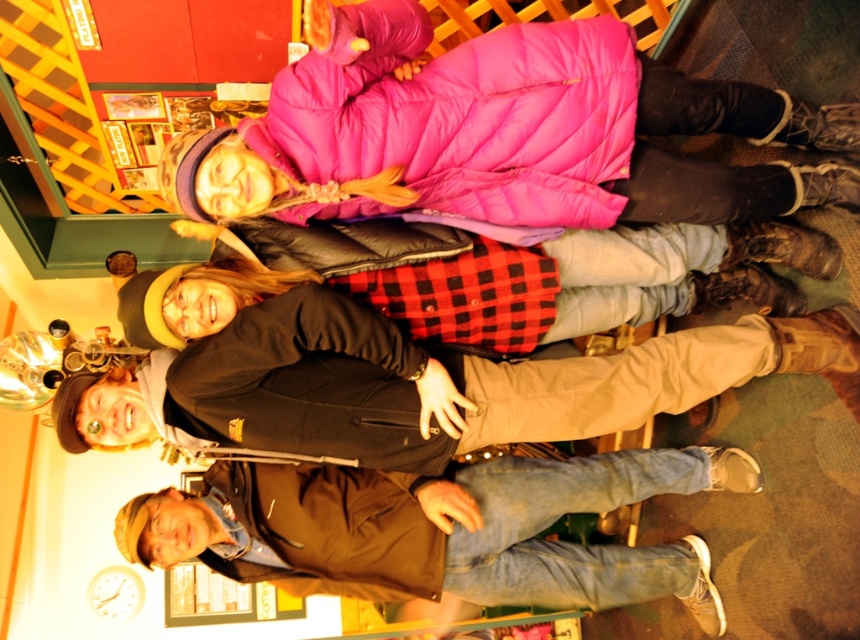
Does pink puffy coat at upper center appear on the right side of black cotton jacket at center?

Yes, pink puffy coat at upper center is to the right of black cotton jacket at center.

Can you confirm if pink puffy coat at upper center is shorter than black cotton jacket at center?

No.

Between point (235, 145) and point (322, 337), which one is positioned in front?

Point (235, 145) is more forward.

Identify the location of pink puffy coat at upper center. Image resolution: width=860 pixels, height=640 pixels. (499, 132).

Who is shorter, black cotton jacket at center or black quilted jacket at upper center?

Standing shorter between the two is black quilted jacket at upper center.

Does black cotton jacket at center have a greater width compared to black quilted jacket at upper center?

Yes, black cotton jacket at center is wider than black quilted jacket at upper center.

At what (x,y) coordinates should I click in order to perform the action: click on black cotton jacket at center. Please return your answer as a coordinate pair (x, y). This screenshot has width=860, height=640. Looking at the image, I should click on tap(452, 381).

Between point (655, 550) and point (415, 268), which one is positioned behind?

Point (655, 550)

Who is more forward, (197, 538) or (646, 262)?

Point (197, 538)

Image resolution: width=860 pixels, height=640 pixels. Find the location of `brown leather jacket at lower right`. brown leather jacket at lower right is located at coordinates (452, 529).